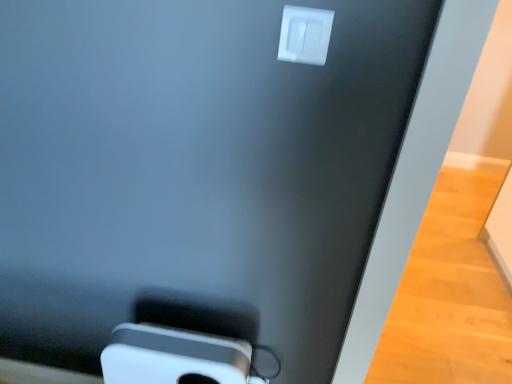
Question: Based on their sizes in the image, would you say white plastic power plugs and sockets at upper center is bigger or smaller than white plastic ipod at lower center?

Choices:
 (A) big
 (B) small

Answer: (B)

Question: Is point (311, 26) closer or farther from the camera than point (156, 377)?

Choices:
 (A) closer
 (B) farther

Answer: (A)

Question: From a real-world perspective, is white plastic power plugs and sockets at upper center physically located above or below white plastic ipod at lower center?

Choices:
 (A) below
 (B) above

Answer: (B)

Question: From the image's perspective, relative to white plastic power plugs and sockets at upper center, is white plastic ipod at lower center above or below?

Choices:
 (A) above
 (B) below

Answer: (B)

Question: Is point (192, 344) closer or farther from the camera than point (284, 31)?

Choices:
 (A) closer
 (B) farther

Answer: (B)

Question: Is white plastic ipod at lower center wider or thinner than white plastic power plugs and sockets at upper center?

Choices:
 (A) thin
 (B) wide

Answer: (B)

Question: Visually, is white plastic ipod at lower center positioned to the left or to the right of white plastic power plugs and sockets at upper center?

Choices:
 (A) left
 (B) right

Answer: (A)